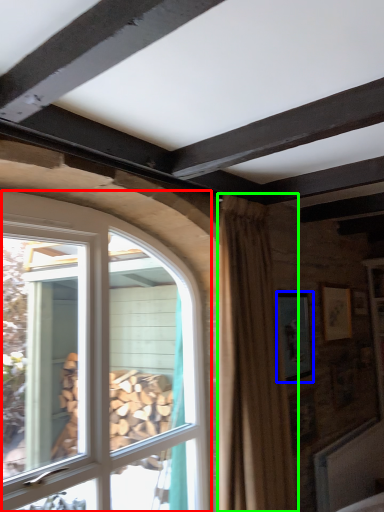
Question: Which object is positioned farthest from window (highlighted by a red box)? Select from picture frame (highlighted by a blue box) and curtain (highlighted by a green box).

Choices:
 (A) picture frame
 (B) curtain

Answer: (A)